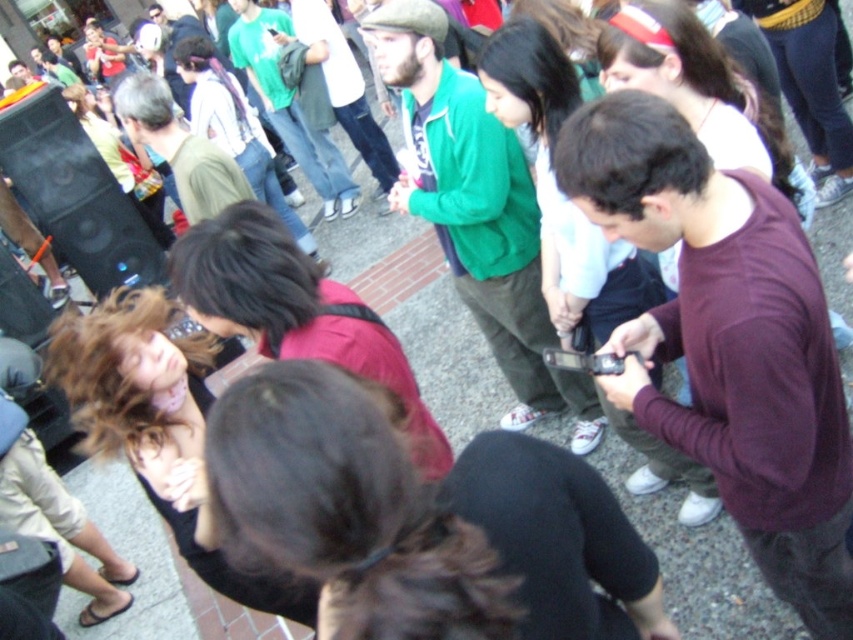
Which is below, maroon sweater at center or black matte speaker at left?

Positioned lower is maroon sweater at center.

Does maroon sweater at center have a greater height compared to black matte speaker at left?

No.

Does point (607, 180) come in front of point (148, 241)?

Yes, it is.

Where is `maroon sweater at center`? The height and width of the screenshot is (640, 853). maroon sweater at center is located at coordinates (728, 340).

Who is lower down, green matte jacket at center or black matte smartphone at center?

black matte smartphone at center

Is green matte jacket at center smaller than black matte smartphone at center?

Actually, green matte jacket at center might be larger than black matte smartphone at center.

Is point (453, 129) closer to camera compared to point (595, 372)?

No, it is not.

In order to click on green matte jacket at center in this screenshot , I will do `click(476, 211)`.

Does maroon sweater at center come behind green matte jacket at center?

No, maroon sweater at center is in front of green matte jacket at center.

Between maroon sweater at center and green matte jacket at center, which one has more height?

green matte jacket at center

Is point (730, 294) farther from viewer compared to point (524, 412)?

No, (730, 294) is closer to viewer.

The width and height of the screenshot is (853, 640). I want to click on maroon sweater at center, so click(728, 340).